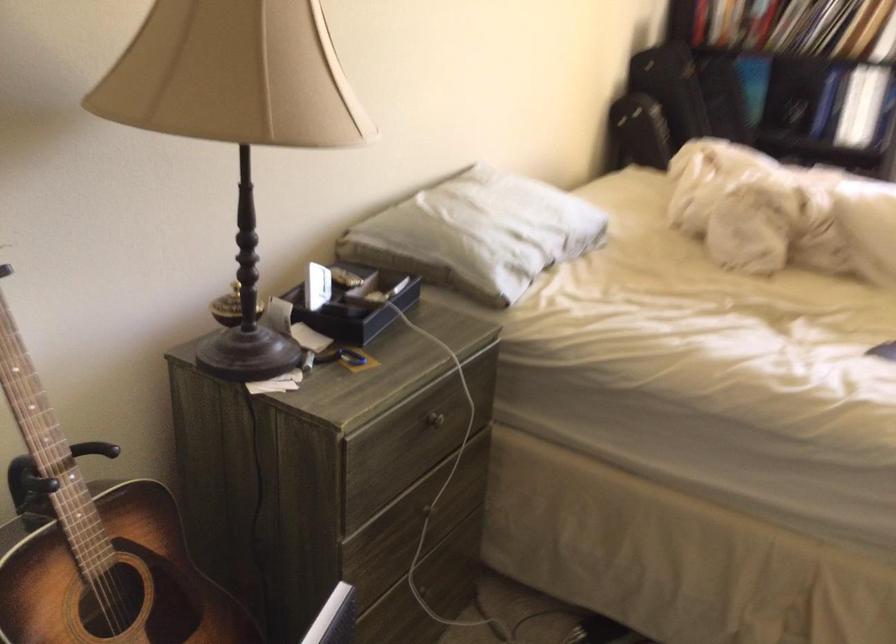
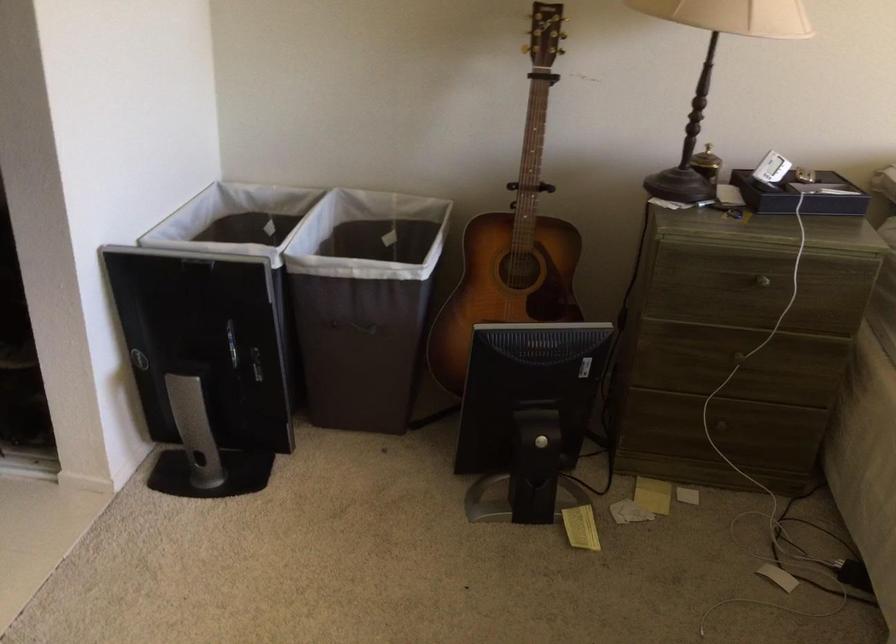
In the second image, find the point that corresponds to (x=428, y=512) in the first image.

(738, 357)